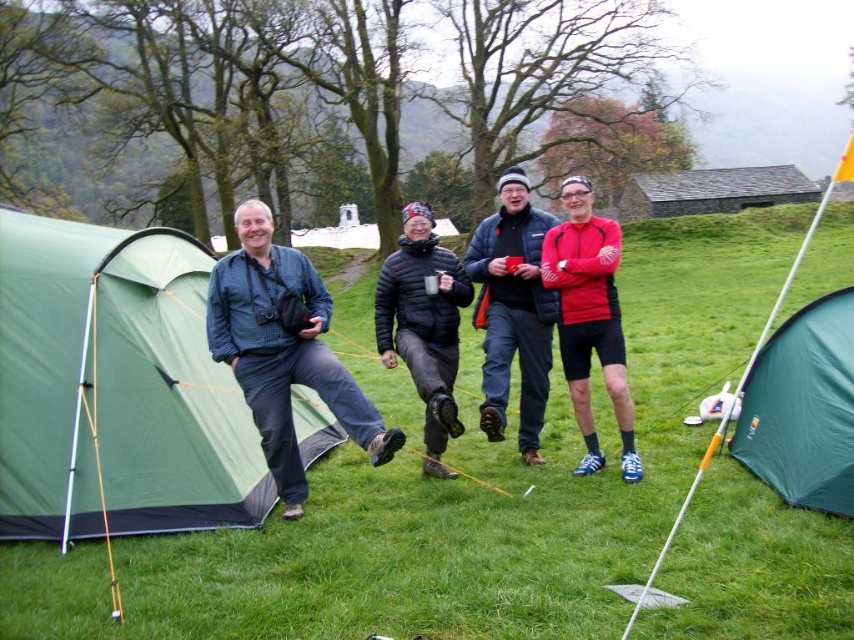
You are planning to set up a tent in this camping scene. You have the green fabric tent at left and the black puffy jacket at center. Which object is closer to the foreground of the image?

The black puffy jacket at center is closer to the foreground because the green fabric tent at left is positioned over it, indicating that the jacket is in front.

You are planning to set up a tent in this camping scene. You have a green fabric tent at left and a matte blue jacket at center. Which object is taller?

The green fabric tent at left is taller than the matte blue jacket at center.